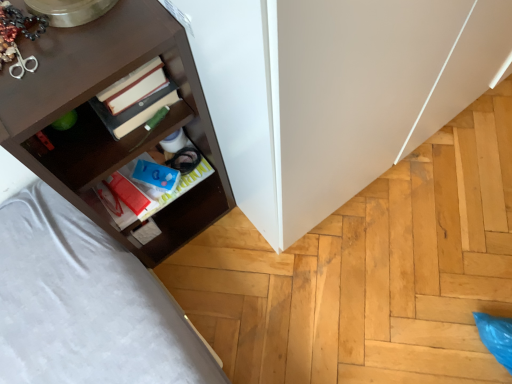
Question: Could matte blue book at center be considered to be inside dark brown wood shelf at left?

Choices:
 (A) yes
 (B) no

Answer: (A)

Question: Is dark brown wood shelf at left not within matte blue book at center?

Choices:
 (A) no
 (B) yes

Answer: (B)

Question: Would you say dark brown wood shelf at left is a long distance from matte blue book at center?

Choices:
 (A) no
 (B) yes

Answer: (A)

Question: From the image's perspective, is dark brown wood shelf at left on top of matte blue book at center?

Choices:
 (A) no
 (B) yes

Answer: (B)

Question: From a real-world perspective, is dark brown wood shelf at left below matte blue book at center?

Choices:
 (A) no
 (B) yes

Answer: (A)

Question: Is dark brown wood shelf at left thinner than matte blue book at center?

Choices:
 (A) yes
 (B) no

Answer: (B)

Question: Does matte blue book at center have a greater height compared to dark brown wood shelf at left?

Choices:
 (A) no
 (B) yes

Answer: (A)

Question: Is matte blue book at center not inside dark brown wood shelf at left?

Choices:
 (A) yes
 (B) no

Answer: (B)

Question: Considering the relative sizes of matte blue book at center and dark brown wood shelf at left in the image provided, is matte blue book at center thinner than dark brown wood shelf at left?

Choices:
 (A) yes
 (B) no

Answer: (A)

Question: From a real-world perspective, is matte blue book at center below dark brown wood shelf at left?

Choices:
 (A) yes
 (B) no

Answer: (A)

Question: Could you tell me if matte blue book at center is turned towards dark brown wood shelf at left?

Choices:
 (A) no
 (B) yes

Answer: (B)

Question: Does matte blue book at center have a lesser height compared to dark brown wood shelf at left?

Choices:
 (A) no
 (B) yes

Answer: (B)

Question: In the image, is dark brown wood shelf at left on the left side or the right side of matte blue book at center?

Choices:
 (A) left
 (B) right

Answer: (A)